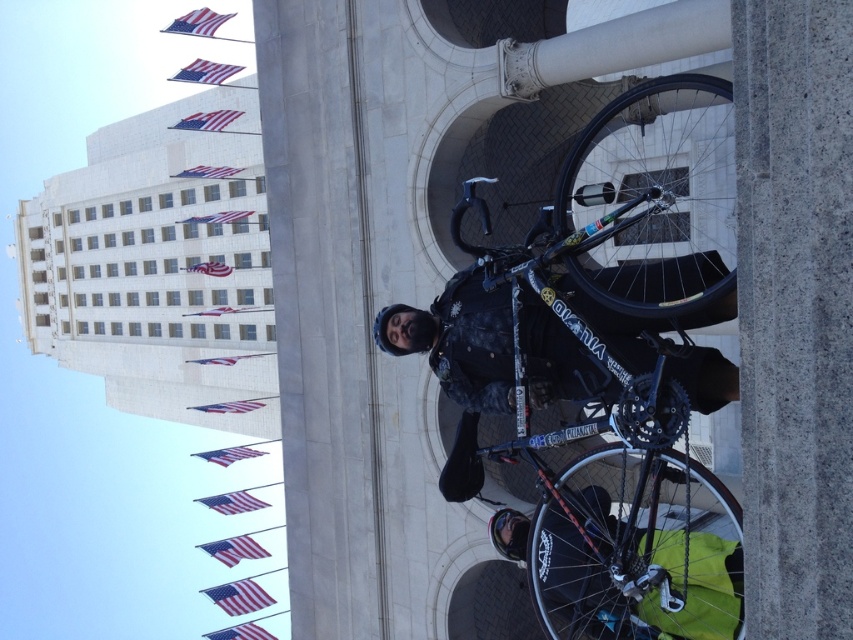
Is black rubber tire at center to the right of dark blue fabric jacket at center from the viewer's perspective?

Correct, you'll find black rubber tire at center to the right of dark blue fabric jacket at center.

Which is behind, point (648, 106) or point (606, 275)?

The point (648, 106) is behind.

Is point (625, 99) closer to viewer compared to point (682, 284)?

No, (625, 99) is behind (682, 284).

In order to click on black rubber tire at center in this screenshot , I will do `click(656, 200)`.

Which is more to the left, shiny black bicycle at center or black rubber tire at center?

shiny black bicycle at center

Between shiny black bicycle at center and black rubber tire at center, which one appears on the right side from the viewer's perspective?

Positioned to the right is black rubber tire at center.

Where is `shiny black bicycle at center`? shiny black bicycle at center is located at coordinates (634, 372).

Measure the distance between shiny black tire at center and black rubber tire at center.

shiny black tire at center and black rubber tire at center are 9.59 meters apart.

Is point (566, 476) less distant than point (666, 257)?

Yes, it is.

Image resolution: width=853 pixels, height=640 pixels. I want to click on shiny black tire at center, so click(636, 548).